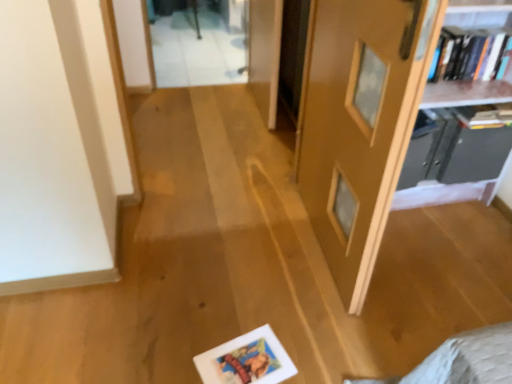
At what (x,y) coordinates should I click in order to perform the action: click on vacant space behind white matte picture frame at lower center. Please return your answer as a coordinate pair (x, y). This screenshot has width=512, height=384. Looking at the image, I should click on (245, 312).